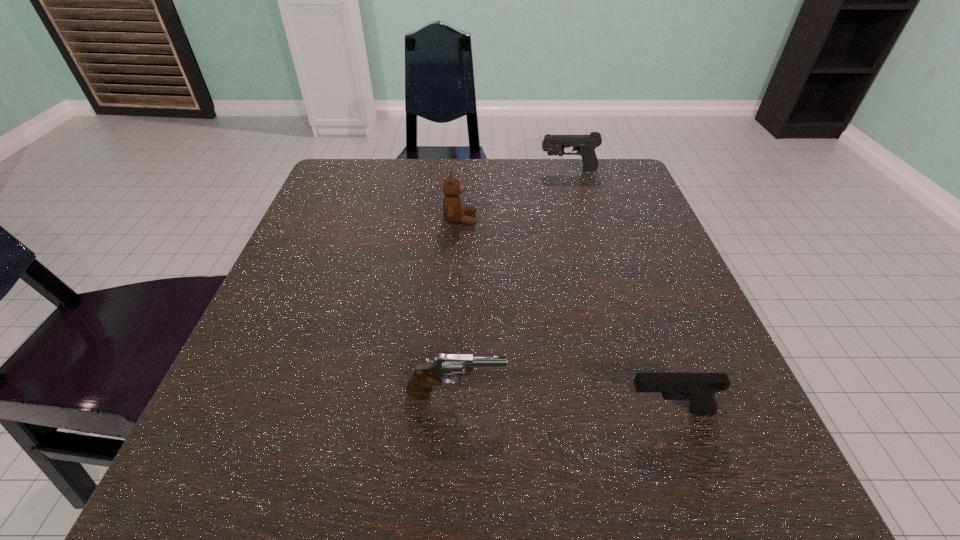
The height and width of the screenshot is (540, 960). I want to click on free space between the nearest pistol and the farthest pistol, so click(618, 291).

The height and width of the screenshot is (540, 960). Identify the location of free space between the leftmost pistol and the teddy bear. (458, 307).

This screenshot has height=540, width=960. What are the coordinates of `object that stands as the third closest to the farthest object` in the screenshot? It's located at (699, 388).

Identify which object is the second closest to the farthest object. Please provide its 2D coordinates. Your answer should be formatted as a tuple, i.e. [(x, y)], where the tuple contains the x and y coordinates of a point satisfying the conditions above.

[(419, 386)]

At what (x,y) coordinates should I click in order to perform the action: click on pistol that is the nearest to the farthest pistol. Please return your answer as a coordinate pair (x, y). The width and height of the screenshot is (960, 540). Looking at the image, I should click on (419, 386).

In order to click on pistol that can be found as the second closest to the nearest pistol in this screenshot , I will do `click(585, 145)`.